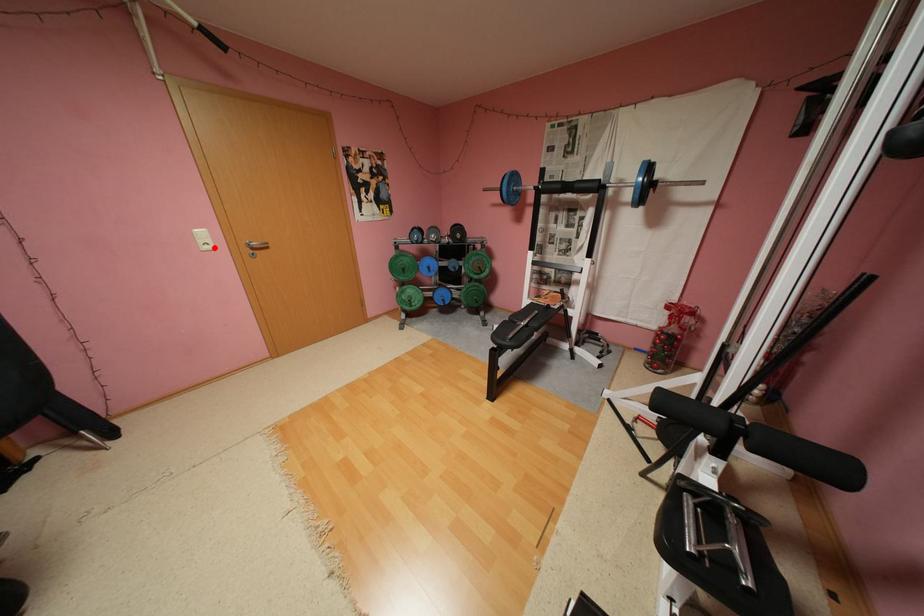
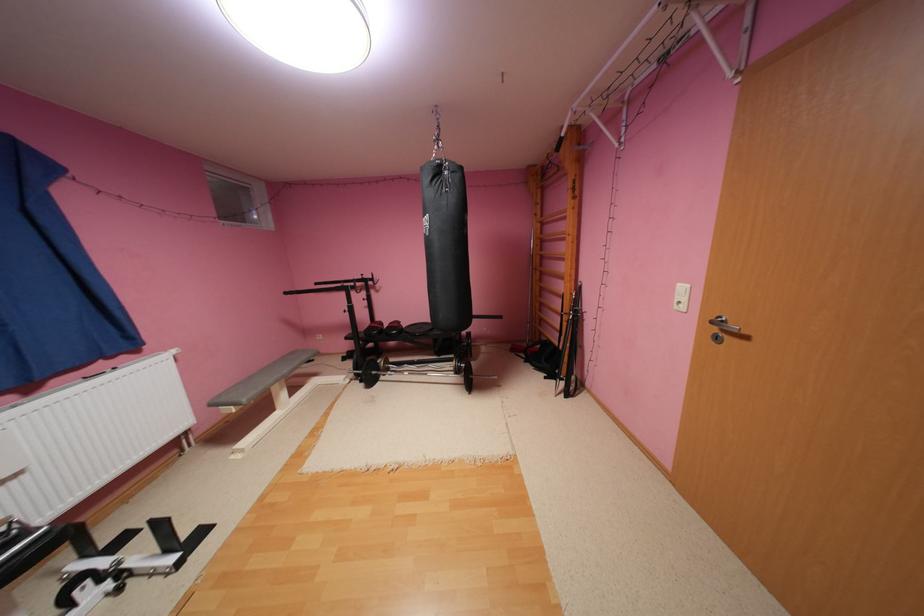
Where in the second image is the point corresponding to the highlighted location from the first image?

(686, 306)